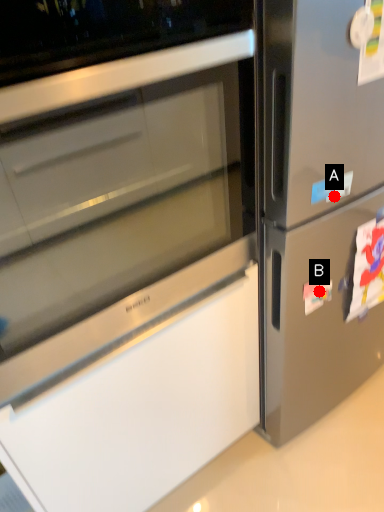
Question: Two points are circled on the image, labeled by A and B beside each circle. Which point is farther to the camera?

Choices:
 (A) A is further
 (B) B is further

Answer: (B)